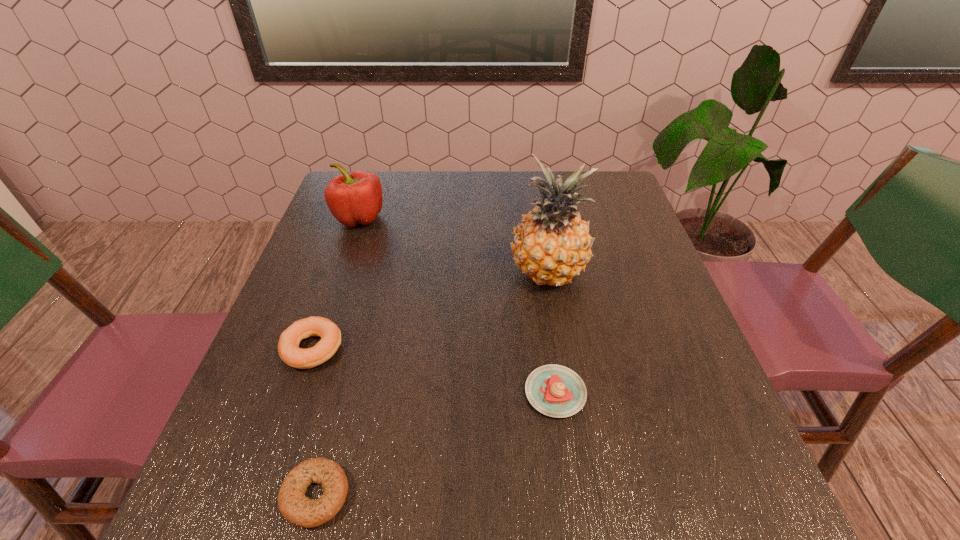
At what (x,y) coordinates should I click in order to perform the action: click on the tallest object. Please return your answer as a coordinate pair (x, y). The height and width of the screenshot is (540, 960). Looking at the image, I should click on (551, 245).

You are a GUI agent. You are given a task and a screenshot of the screen. Output one action in this format:
    pyautogui.click(x=<x>, y=<y>)
    Task: Click on the pineapple
    This screenshot has height=540, width=960.
    Given the screenshot: What is the action you would take?
    pyautogui.click(x=551, y=245)

The image size is (960, 540). I want to click on bell pepper, so coord(356,198).

Locate an element on the screen. The height and width of the screenshot is (540, 960). the second tallest object is located at coordinates (356, 198).

At what (x,y) coordinates should I click in order to perform the action: click on the taller bagel. Please return your answer as a coordinate pair (x, y). Image resolution: width=960 pixels, height=540 pixels. Looking at the image, I should click on (288, 346).

The height and width of the screenshot is (540, 960). Identify the location of the farther bagel. (288, 346).

What are the coordinates of `pastry` in the screenshot? It's located at (554, 390).

At what (x,y) coordinates should I click in order to perform the action: click on the nearer bagel. Please return your answer as a coordinate pair (x, y). Image resolution: width=960 pixels, height=540 pixels. Looking at the image, I should click on (297, 509).

Image resolution: width=960 pixels, height=540 pixels. In order to click on the shorter bagel in this screenshot , I will do `click(297, 509)`.

Image resolution: width=960 pixels, height=540 pixels. What are the coordinates of `vacant space located on the back of the tallest object` in the screenshot? It's located at (531, 172).